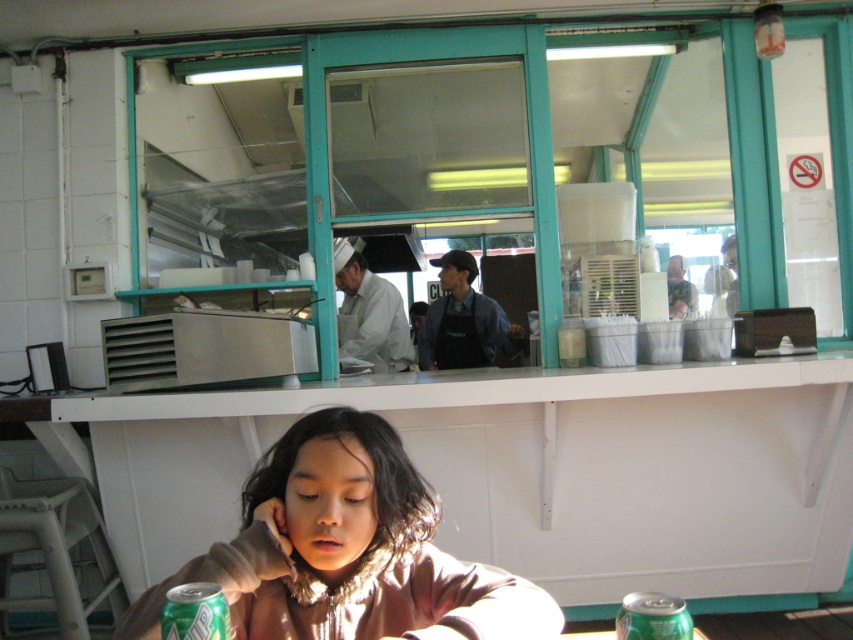
You are a customer sitting at the table in the food service area. You want to place your green soda can exactly at the point marked by coordinates (534, 472). Is this point located on the white matte table at lower center?

Yes, the point marked by coordinates (534, 472) is located on the white matte table at lower center, so placing the green soda can there would be possible.

Based on the photo, you are a person sitting at the white matte table at lower center and wearing the brown fuzzy jacket at lower center. You want to reach for a napkin placed on the table. Will your jacket sleeves get in the way when you reach forward?

The white matte table at lower center is much taller than the brown fuzzy jacket at lower center, so when you reach forward, your jacket sleeves are unlikely to get in the way because the table is elevated above the jacket.

You are standing in the food service area and want to take a photo of both the point at coordinates (604,429) and the point at (85,508). Which point should you focus on first to ensure both are in focus?

You should focus on the point at (604,429) first since it is closer to the camera than the point at (85,508). This way, adjusting the focus from near to far will help both points be in focus.